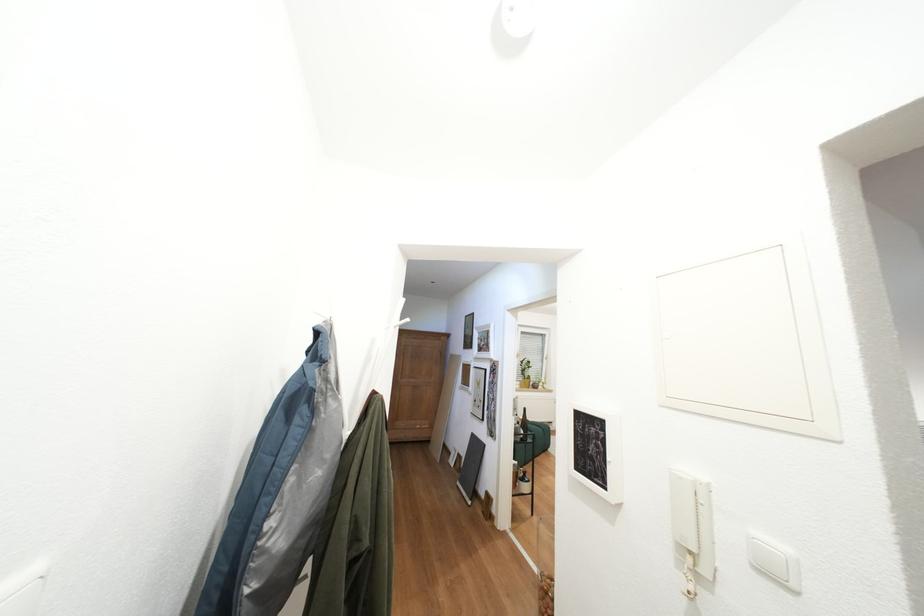
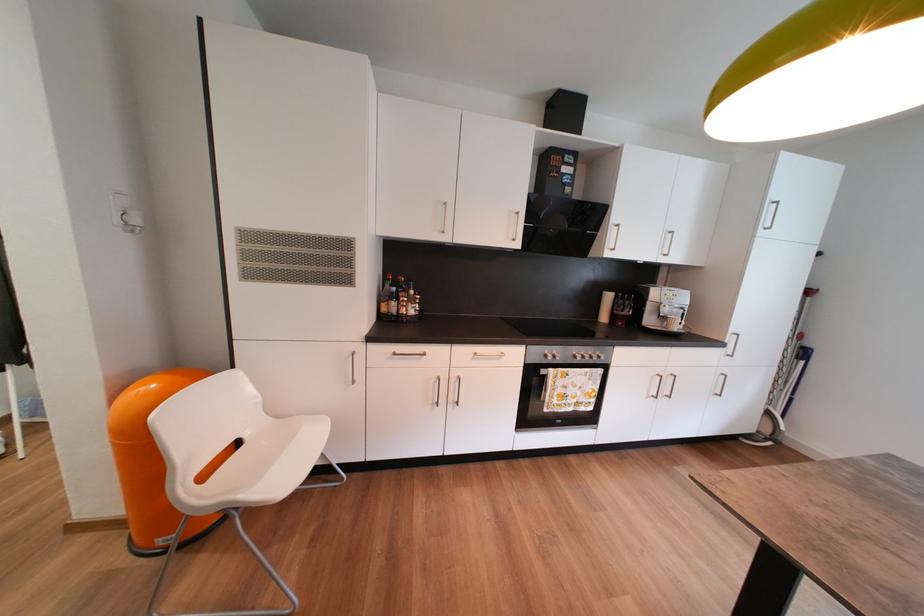
Question: What movement of the cameraman would produce the second image?

Choices:
 (A) Left
 (B) Right
 (C) Forward
 (D) Backward

Answer: (B)